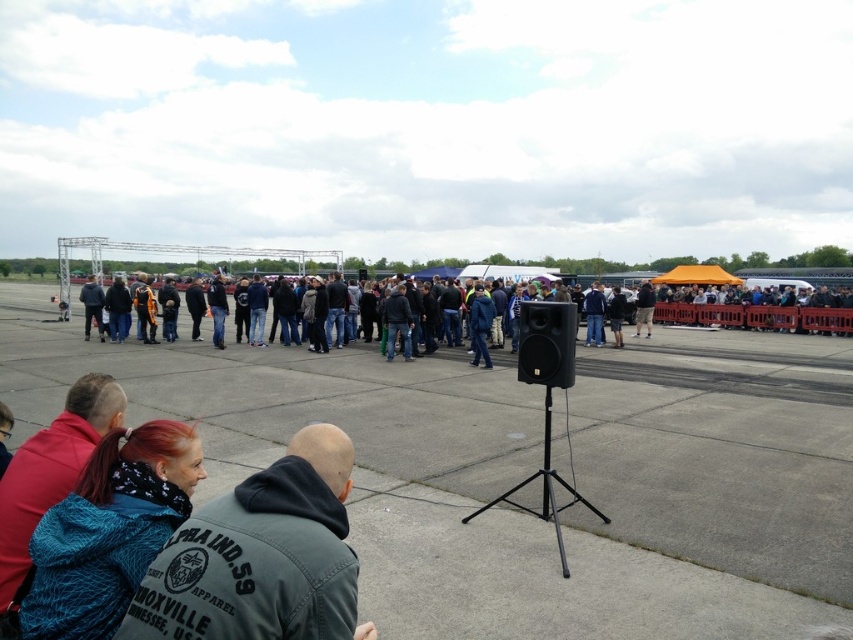
Is gray concrete tarmac at center to the right of black matte speaker at center from the viewer's perspective?

No, gray concrete tarmac at center is not to the right of black matte speaker at center.

Which is below, gray concrete tarmac at center or black matte speaker at center?

Positioned lower is gray concrete tarmac at center.

Is point (134, 356) closer to camera compared to point (555, 355)?

That is False.

At what (x,y) coordinates should I click in order to perform the action: click on gray concrete tarmac at center. Please return your answer as a coordinate pair (x, y). The width and height of the screenshot is (853, 640). Looking at the image, I should click on (508, 481).

Between point (283, 362) and point (827, 339), which one is positioned behind?

The point (827, 339) is behind.

You are a GUI agent. You are given a task and a screenshot of the screen. Output one action in this format:
    pyautogui.click(x=<x>, y=<y>)
    Task: Click on the gray concrete tarmac at center
    Image resolution: width=853 pixels, height=640 pixels.
    Given the screenshot: What is the action you would take?
    pyautogui.click(x=508, y=481)

Where is `teal textured jacket at lower left`? Image resolution: width=853 pixels, height=640 pixels. teal textured jacket at lower left is located at coordinates (108, 531).

Does teal textured jacket at lower left have a lesser width compared to dark gray jacket at center?

No, teal textured jacket at lower left is not thinner than dark gray jacket at center.

Which is behind, point (125, 429) or point (328, 292)?

Positioned behind is point (328, 292).

The height and width of the screenshot is (640, 853). In order to click on teal textured jacket at lower left in this screenshot , I will do `click(108, 531)`.